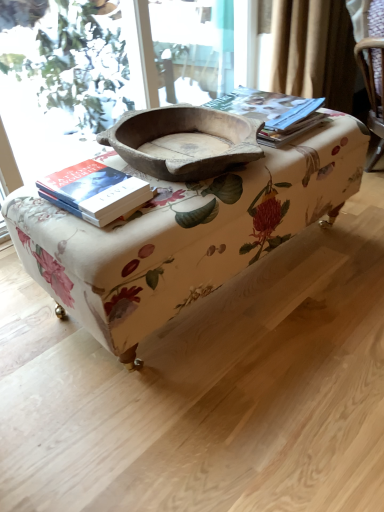
At what (x,y) coordinates should I click in order to perform the action: click on free spot above hardcover book at left (from a real-world perspective). Please return your answer as a coordinate pair (x, y). The width and height of the screenshot is (384, 512). Looking at the image, I should click on (89, 181).